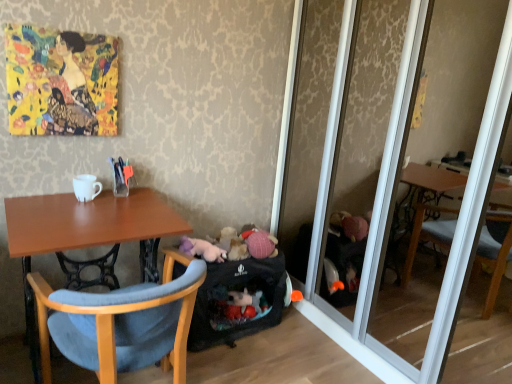
Question: Is the depth of black fabric baby carriage at lower center greater than that of fluffy white stuffed animal at lower center?

Choices:
 (A) no
 (B) yes

Answer: (A)

Question: Is black fabric baby carriage at lower center wider than fluffy white stuffed animal at lower center?

Choices:
 (A) yes
 (B) no

Answer: (A)

Question: From the image's perspective, would you say black fabric baby carriage at lower center is positioned over fluffy white stuffed animal at lower center?

Choices:
 (A) no
 (B) yes

Answer: (A)

Question: Is fluffy white stuffed animal at lower center surrounded by black fabric baby carriage at lower center?

Choices:
 (A) yes
 (B) no

Answer: (B)

Question: Is black fabric baby carriage at lower center to the left of fluffy white stuffed animal at lower center from the viewer's perspective?

Choices:
 (A) yes
 (B) no

Answer: (B)

Question: In terms of size, does fluffy white stuffed animal at lower center appear bigger or smaller than white glossy mug at upper left?

Choices:
 (A) small
 (B) big

Answer: (B)

Question: Is fluffy white stuffed animal at lower center in front of or behind white glossy mug at upper left in the image?

Choices:
 (A) front
 (B) behind

Answer: (B)

Question: In the image, is fluffy white stuffed animal at lower center on the left side or the right side of white glossy mug at upper left?

Choices:
 (A) right
 (B) left

Answer: (A)

Question: In terms of height, does fluffy white stuffed animal at lower center look taller or shorter compared to white glossy mug at upper left?

Choices:
 (A) short
 (B) tall

Answer: (A)

Question: In terms of width, does white glossy mug at upper left look wider or thinner when compared to light blue fabric chair at lower left?

Choices:
 (A) wide
 (B) thin

Answer: (B)

Question: Is white glossy mug at upper left spatially inside light blue fabric chair at lower left, or outside of it?

Choices:
 (A) inside
 (B) outside

Answer: (B)

Question: In the image, is white glossy mug at upper left on the left side or the right side of light blue fabric chair at lower left?

Choices:
 (A) right
 (B) left

Answer: (B)

Question: Considering the positions of point (99, 190) and point (181, 342), is point (99, 190) closer or farther from the camera than point (181, 342)?

Choices:
 (A) farther
 (B) closer

Answer: (A)

Question: Looking at the image, does gold textured painting at upper left seem bigger or smaller compared to fluffy white stuffed animal at lower center?

Choices:
 (A) small
 (B) big

Answer: (B)

Question: Is gold textured painting at upper left wider or thinner than fluffy white stuffed animal at lower center?

Choices:
 (A) thin
 (B) wide

Answer: (A)